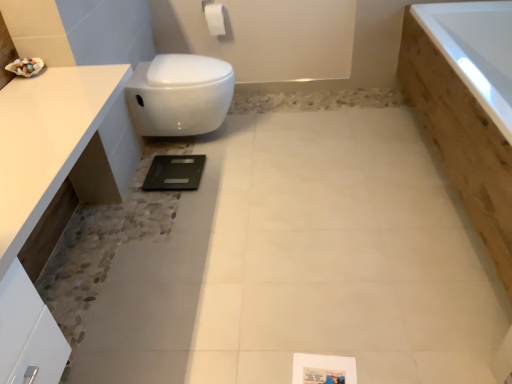
What is the approximate width of wooden bathtub at right?

It is 31.48 inches.

Measure the distance between wooden bathtub at right and camera.

They are 1.47 meters apart.

Locate an element on the screen. white glossy countertop at upper left is located at coordinates (47, 140).

Based on the photo, in order to face white matte toilet paper at upper center, should I rotate leftwards or rightwards?

It's best to rotate left around 4.939 degrees.

Identify the location of white glossy toilet at upper left. This screenshot has height=384, width=512. (180, 95).

At what (x,y) coordinates should I click in order to perform the action: click on wooden bathtub at right. Please return your answer as a coordinate pair (x, y). The width and height of the screenshot is (512, 384). Looking at the image, I should click on (461, 141).

Can you confirm if wooden bathtub at right is smaller than white glossy countertop at upper left?

No.

Do you think wooden bathtub at right is within white glossy countertop at upper left, or outside of it?

wooden bathtub at right is not inside white glossy countertop at upper left, it's outside.

What's the angular difference between wooden bathtub at right and white glossy countertop at upper left's facing directions?

The facing directions of wooden bathtub at right and white glossy countertop at upper left are 180 degrees apart.

In the scene shown: Is white matte toilet paper at upper center facing away from white glossy countertop at upper left?

white matte toilet paper at upper center is not turned away from white glossy countertop at upper left.

Does white matte toilet paper at upper center come behind white glossy countertop at upper left?

Yes, white matte toilet paper at upper center is behind white glossy countertop at upper left.

Between point (217, 5) and point (39, 210), which one is positioned in front?

The point (39, 210) is in front.

Which object is positioned more to the left, white matte toilet paper at upper center or white glossy countertop at upper left?

white glossy countertop at upper left.

Is white glossy toilet at upper left in front of wooden bathtub at right?

No, it is not.

Looking at the image, does white glossy toilet at upper left seem bigger or smaller compared to wooden bathtub at right?

Clearly, white glossy toilet at upper left is smaller in size than wooden bathtub at right.

Based on their positions, is white glossy toilet at upper left located to the left or right of wooden bathtub at right?

white glossy toilet at upper left is to the left of wooden bathtub at right.

From a real-world perspective, which object rests below the other?

white glossy toilet at upper left.

From the image's perspective, is white glossy toilet at upper left located above or below white matte toilet paper at upper center?

Based on their image positions, white glossy toilet at upper left is located beneath white matte toilet paper at upper center.

Is white matte toilet paper at upper center surrounded by white glossy toilet at upper left?

No, white matte toilet paper at upper center is not surrounded by white glossy toilet at upper left.

Which object is positioned more to the right, white glossy toilet at upper left or white matte toilet paper at upper center?

white matte toilet paper at upper center is more to the right.

Measure the distance from white matte toilet paper at upper center to wooden bathtub at right.

They are 1.53 meters apart.

From a real-world perspective, between white matte toilet paper at upper center and wooden bathtub at right, who is vertically lower?

In real-world perspective, wooden bathtub at right is lower.

Which point is more forward, (213,22) or (468,206)?

Point (468,206)

Looking at the image, does white matte toilet paper at upper center seem bigger or smaller compared to wooden bathtub at right?

Considering their sizes, white matte toilet paper at upper center takes up less space than wooden bathtub at right.

Considering the relative sizes of white matte toilet paper at upper center and white glossy toilet at upper left in the image provided, is white matte toilet paper at upper center taller than white glossy toilet at upper left?

In fact, white matte toilet paper at upper center may be shorter than white glossy toilet at upper left.

Based on the photo, which is behind, white matte toilet paper at upper center or white glossy toilet at upper left?

white matte toilet paper at upper center.

In the scene shown: Could you tell me if white matte toilet paper at upper center is facing white glossy toilet at upper left?

Yes, white matte toilet paper at upper center is aimed at white glossy toilet at upper left.

Does point (217, 9) come closer to viewer compared to point (182, 107)?

That is False.

Consider the image. Who is taller, white glossy toilet at upper left or white glossy countertop at upper left?

white glossy countertop at upper left is taller.

From the image's perspective, which one is positioned higher, white glossy toilet at upper left or white glossy countertop at upper left?

white glossy toilet at upper left appears higher in the image.

Is white glossy toilet at upper left to the left of white glossy countertop at upper left from the viewer's perspective?

No.

From a real-world perspective, who is located higher, white glossy toilet at upper left or white glossy countertop at upper left?

white glossy countertop at upper left is physically above.

Locate an element on the screen. bath that is under the white glossy countertop at upper left (from a real-world perspective) is located at coordinates 461,141.

Find the location of `toilet paper on the right of white glossy countertop at upper left`. toilet paper on the right of white glossy countertop at upper left is located at coordinates (215, 19).

From the image, which object appears to be nearer to white matte toilet paper at upper center, white glossy toilet at upper left or wooden bathtub at right?

white glossy toilet at upper left.

Based on the photo, which object lies nearer to the anchor point white glossy toilet at upper left, wooden bathtub at right or white glossy countertop at upper left?

white glossy countertop at upper left.

Which object lies nearer to the anchor point wooden bathtub at right, white matte toilet paper at upper center or white glossy toilet at upper left?

Among the two, white glossy toilet at upper left is located nearer to wooden bathtub at right.

Considering their positions, is white glossy countertop at upper left positioned further to white matte toilet paper at upper center than wooden bathtub at right?

white glossy countertop at upper left.

Consider the image. Estimate the real-world distances between objects in this image. Which object is closer to white glossy countertop at upper left, white matte toilet paper at upper center or white glossy toilet at upper left?

white glossy toilet at upper left is closer to white glossy countertop at upper left.

Based on their spatial positions, is white matte toilet paper at upper center or wooden bathtub at right further from white glossy toilet at upper left?

wooden bathtub at right.

Looking at this image, looking at the image, which one is located closer to white glossy countertop at upper left, wooden bathtub at right or white glossy toilet at upper left?

white glossy toilet at upper left.

Based on their spatial positions, is white glossy toilet at upper left or wooden bathtub at right further from white glossy countertop at upper left?

Based on the image, wooden bathtub at right appears to be further to white glossy countertop at upper left.

At what (x,y) coordinates should I click in order to perform the action: click on toilet positioned between white glossy countertop at upper left and white matte toilet paper at upper center from near to far. Please return your answer as a coordinate pair (x, y). Looking at the image, I should click on (180, 95).

I want to click on toilet paper situated between white glossy countertop at upper left and wooden bathtub at right from left to right, so click(x=215, y=19).

Identify the location of toilet paper between white glossy toilet at upper left and wooden bathtub at right from left to right. This screenshot has height=384, width=512. (215, 19).

Locate an element on the screen. This screenshot has height=384, width=512. toilet situated between white glossy countertop at upper left and wooden bathtub at right from left to right is located at coordinates (180, 95).